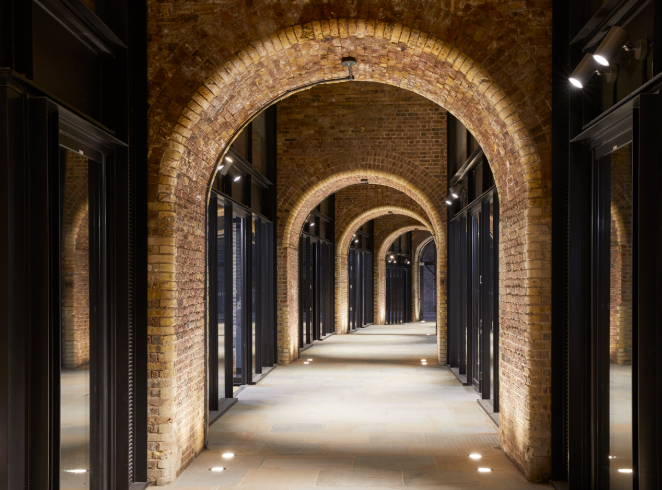
Where is `grout`? grout is located at coordinates (244, 478), (314, 480), (308, 468), (402, 482), (438, 462), (352, 463).